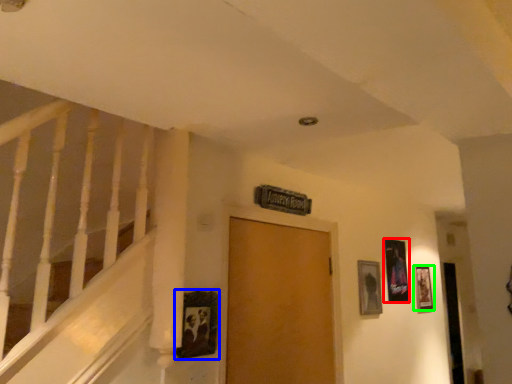
Question: Which object is the closest to the picture frame (highlighted by a red box)? Choose among these: picture frame (highlighted by a blue box) or picture frame (highlighted by a green box).

Choices:
 (A) picture frame
 (B) picture frame

Answer: (B)